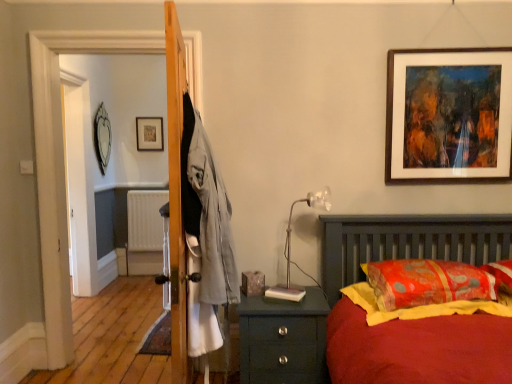
Question: Does brown wooden picture frame at upper right, the first picture frame in the right-to-left sequence, have a greater height compared to orange fabric pillow at right?

Choices:
 (A) no
 (B) yes

Answer: (B)

Question: Is orange fabric pillow at right located within brown wooden picture frame at upper right, the 3th picture frame when ordered from left to right?

Choices:
 (A) yes
 (B) no

Answer: (B)

Question: Is brown wooden picture frame at upper right, which appears as the third picture frame when viewed from the back, next to orange fabric pillow at right and touching it?

Choices:
 (A) yes
 (B) no

Answer: (B)

Question: From a real-world perspective, does brown wooden picture frame at upper right, the 3th picture frame when ordered from left to right, sit lower than orange fabric pillow at right?

Choices:
 (A) yes
 (B) no

Answer: (B)

Question: Is the depth of brown wooden picture frame at upper right, the first picture frame in the right-to-left sequence, greater than that of orange fabric pillow at right?

Choices:
 (A) yes
 (B) no

Answer: (A)

Question: From a real-world perspective, is translucent plastic table lamp at right positioned above or below wooden picture frame at upper center, the first picture frame viewed from the back?

Choices:
 (A) below
 (B) above

Answer: (A)

Question: Considering the positions of point (288, 274) and point (146, 135), is point (288, 274) closer or farther from the camera than point (146, 135)?

Choices:
 (A) farther
 (B) closer

Answer: (B)

Question: Is translucent plastic table lamp at right bigger or smaller than wooden picture frame at upper center, the first picture frame viewed from the back?

Choices:
 (A) big
 (B) small

Answer: (A)

Question: Based on their positions, is translucent plastic table lamp at right located to the left or right of wooden picture frame at upper center, which is the second picture frame in left-to-right order?

Choices:
 (A) right
 (B) left

Answer: (A)

Question: Relative to teal wooden nightstand at lower right, is wooden screen door at left in front or behind?

Choices:
 (A) behind
 (B) front

Answer: (A)

Question: In terms of width, does wooden screen door at left look wider or thinner when compared to teal wooden nightstand at lower right?

Choices:
 (A) wide
 (B) thin

Answer: (B)

Question: From a real-world perspective, is wooden screen door at left above or below teal wooden nightstand at lower right?

Choices:
 (A) below
 (B) above

Answer: (B)

Question: Is wooden screen door at left inside the boundaries of teal wooden nightstand at lower right, or outside?

Choices:
 (A) inside
 (B) outside

Answer: (B)

Question: Based on their positions, is translucent plastic table lamp at right located to the left or right of wooden screen door at left?

Choices:
 (A) right
 (B) left

Answer: (A)

Question: In terms of width, does translucent plastic table lamp at right look wider or thinner when compared to wooden screen door at left?

Choices:
 (A) thin
 (B) wide

Answer: (A)